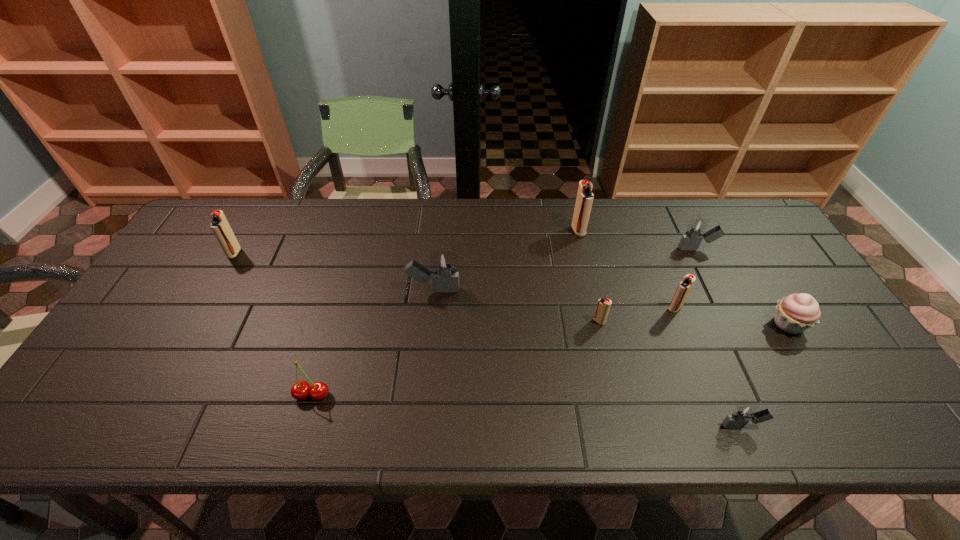
The width and height of the screenshot is (960, 540). What are the coordinates of `gray igniter that is the nearest to the biggest red igniter` in the screenshot? It's located at (695, 230).

The height and width of the screenshot is (540, 960). Find the location of `the third closest gray igniter to the second biggest red igniter`. the third closest gray igniter to the second biggest red igniter is located at coordinates (744, 413).

This screenshot has width=960, height=540. In order to click on free space that satisfies the following two spatial constraints: 1. on the front side of the nearest red igniter; 2. on the left side of the leftmost gray igniter in this screenshot , I will do `click(431, 321)`.